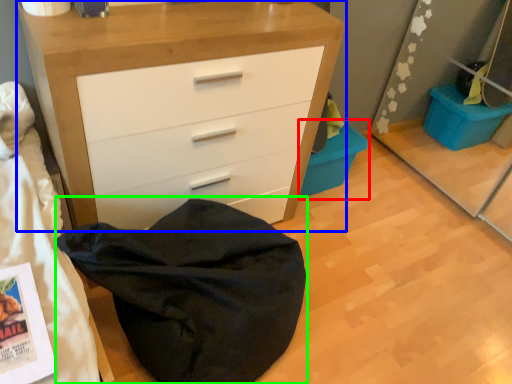
Question: Considering the real-world distances, which object is closest to cabinetry (highlighted by a red box)? chest of drawers (highlighted by a blue box) or bean bag chair (highlighted by a green box).

Choices:
 (A) chest of drawers
 (B) bean bag chair

Answer: (A)